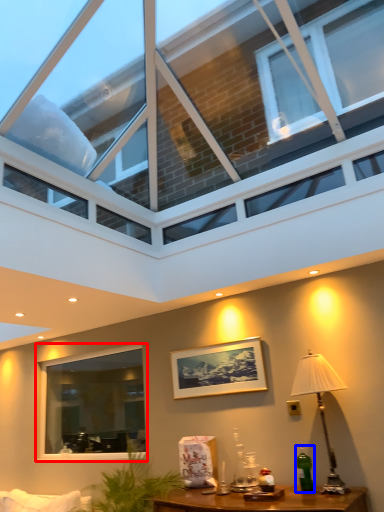
Question: Among these objects, which one is farthest to the camera, window (highlighted by a red box) or bottle (highlighted by a blue box)?

Choices:
 (A) window
 (B) bottle

Answer: (A)